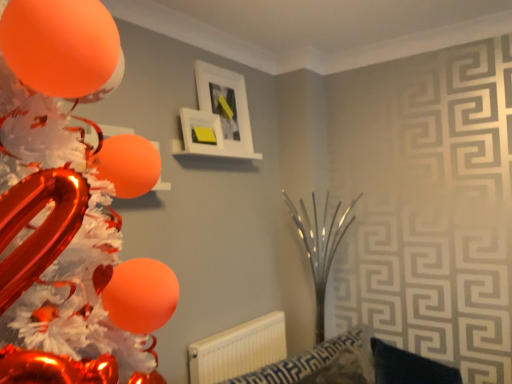
Describe the element at coordinates (217, 116) in the screenshot. The height and width of the screenshot is (384, 512). I see `white matte picture frame at upper center, positioned as the 2th picture frame in front-to-back order` at that location.

You are a GUI agent. You are given a task and a screenshot of the screen. Output one action in this format:
    pyautogui.click(x=<x>, y=<y>)
    Task: Click on the white plastic radiator at lower center
    The width and height of the screenshot is (512, 384).
    Given the screenshot: What is the action you would take?
    pyautogui.click(x=238, y=349)

What do you see at coordinates (201, 132) in the screenshot?
I see `white matte picture frame at upper center, the first picture frame viewed from the front` at bounding box center [201, 132].

At what (x,y) coordinates should I click in order to perform the action: click on white matte picture frame at upper center, positioned as the 2th picture frame in front-to-back order. Please return your answer as a coordinate pair (x, y). The height and width of the screenshot is (384, 512). Looking at the image, I should click on (217, 116).

From the image's perspective, which is below, white matte picture frame at upper center, positioned as the 2th picture frame in front-to-back order, or white plastic radiator at lower center?

From the image's view, white plastic radiator at lower center is below.

This screenshot has width=512, height=384. What are the coordinates of `the 1st picture frame counting from the left side of the white plastic radiator at lower center` in the screenshot? It's located at (217, 116).

From the picture: From a real-world perspective, who is located higher, white matte picture frame at upper center, which is counted as the first picture frame, starting from the back, or white plastic radiator at lower center?

white matte picture frame at upper center, which is counted as the first picture frame, starting from the back, from a real-world perspective.

Considering the relative sizes of white plastic radiator at lower center and white matte picture frame at upper center, positioned as the 2th picture frame in front-to-back order, in the image provided, is white plastic radiator at lower center shorter than white matte picture frame at upper center, positioned as the 2th picture frame in front-to-back order,?

Yes, white plastic radiator at lower center is shorter than white matte picture frame at upper center, positioned as the 2th picture frame in front-to-back order.

Could you measure the distance between white plastic radiator at lower center and white matte picture frame at upper center, which is counted as the first picture frame, starting from the back?

1.06 meters.

This screenshot has width=512, height=384. There is a white plastic radiator at lower center. Find the location of `the 2nd picture frame above it (from the image's perspective)`. the 2nd picture frame above it (from the image's perspective) is located at coordinates (217, 116).

From a real-world perspective, is white plastic radiator at lower center positioned under white matte picture frame at upper center, positioned as the 2th picture frame in front-to-back order, based on gravity?

Yes, from a real-world perspective, white plastic radiator at lower center is below white matte picture frame at upper center, positioned as the 2th picture frame in front-to-back order.

From the image's perspective, is white matte picture frame at upper center, positioned as the 2th picture frame in front-to-back order, over white matte picture frame at upper center, the 2th picture frame in the back-to-front sequence?

Yes, from the image's perspective, white matte picture frame at upper center, positioned as the 2th picture frame in front-to-back order, is above white matte picture frame at upper center, the 2th picture frame in the back-to-front sequence.

Does white matte picture frame at upper center, which is counted as the first picture frame, starting from the back, have a smaller size compared to white matte picture frame at upper center, the first picture frame viewed from the front?

Incorrect, white matte picture frame at upper center, which is counted as the first picture frame, starting from the back, is not smaller in size than white matte picture frame at upper center, the first picture frame viewed from the front.

Who is shorter, white matte picture frame at upper center, which is counted as the first picture frame, starting from the back, or white matte picture frame at upper center, the first picture frame viewed from the front?

white matte picture frame at upper center, the first picture frame viewed from the front.

Based on their sizes in the image, would you say orange glossy balloon at left is bigger or smaller than white matte picture frame at upper center, positioned as the 2th picture frame in front-to-back order?

orange glossy balloon at left is bigger than white matte picture frame at upper center, positioned as the 2th picture frame in front-to-back order.

From the image's perspective, which is below, orange glossy balloon at left or white matte picture frame at upper center, positioned as the 2th picture frame in front-to-back order?

orange glossy balloon at left.

Could you tell me if orange glossy balloon at left is facing white matte picture frame at upper center, which is counted as the first picture frame, starting from the back?

No.

From the image's perspective, count 2nd picture frames upward from the orange glossy balloon at left and point to it. Please provide its 2D coordinates.

[(217, 116)]

Where is `balloon that is above the white plastic radiator at lower center (from the image's perspective)`? balloon that is above the white plastic radiator at lower center (from the image's perspective) is located at coordinates (57, 249).

Would you say white plastic radiator at lower center contains orange glossy balloon at left?

No, orange glossy balloon at left is not surrounded by white plastic radiator at lower center.

From the image's perspective, is white plastic radiator at lower center over orange glossy balloon at left?

Actually, white plastic radiator at lower center appears below orange glossy balloon at left in the image.

Is white plastic radiator at lower center directly adjacent to orange glossy balloon at left?

No, white plastic radiator at lower center is not making contact with orange glossy balloon at left.

Consider the image. From a real-world perspective, is orange glossy balloon at left positioned under white plastic radiator at lower center based on gravity?

Actually, orange glossy balloon at left is physically above white plastic radiator at lower center in the real world.

Looking at their sizes, would you say orange glossy balloon at left is wider or thinner than white plastic radiator at lower center?

In the image, orange glossy balloon at left appears to be wider than white plastic radiator at lower center.

Is orange glossy balloon at left positioned beyond the bounds of white plastic radiator at lower center?

Yes, orange glossy balloon at left is not within white plastic radiator at lower center.

From a real-world perspective, which picture frame is the 1st one above the orange glossy balloon at left? Please provide its 2D coordinates.

[(201, 132)]

Can you confirm if orange glossy balloon at left is smaller than white matte picture frame at upper center, the first picture frame viewed from the front?

Actually, orange glossy balloon at left might be larger than white matte picture frame at upper center, the first picture frame viewed from the front.

Considering the relative positions of orange glossy balloon at left and white matte picture frame at upper center, the 2th picture frame in the back-to-front sequence, in the image provided, is orange glossy balloon at left in front of white matte picture frame at upper center, the 2th picture frame in the back-to-front sequence,?

Yes, it is.

In terms of height, does orange glossy balloon at left look taller or shorter compared to white matte picture frame at upper center, the 2th picture frame in the back-to-front sequence?

orange glossy balloon at left is taller than white matte picture frame at upper center, the 2th picture frame in the back-to-front sequence.

In order to click on picture frame that is the 2nd one above the white plastic radiator at lower center (from a real-world perspective) in this screenshot , I will do `click(217, 116)`.

Locate an element on the screen. radiator below the white matte picture frame at upper center, positioned as the 2th picture frame in front-to-back order (from a real-world perspective) is located at coordinates (238, 349).

Based on their spatial positions, is white plastic radiator at lower center or white matte picture frame at upper center, positioned as the 2th picture frame in front-to-back order, further from orange glossy balloon at left?

Based on the image, white plastic radiator at lower center appears to be further to orange glossy balloon at left.

From the image, which object appears to be nearer to white matte picture frame at upper center, the 2th picture frame in the back-to-front sequence, white plastic radiator at lower center or orange glossy balloon at left?

The object closer to white matte picture frame at upper center, the 2th picture frame in the back-to-front sequence, is white plastic radiator at lower center.

Looking at the image, which one is located closer to white matte picture frame at upper center, positioned as the 2th picture frame in front-to-back order, white matte picture frame at upper center, the first picture frame viewed from the front, or white plastic radiator at lower center?

Among the two, white matte picture frame at upper center, the first picture frame viewed from the front, is located nearer to white matte picture frame at upper center, positioned as the 2th picture frame in front-to-back order.

Looking at the image, which one is located further to white matte picture frame at upper center, the 2th picture frame in the back-to-front sequence, orange glossy balloon at left or white matte picture frame at upper center, positioned as the 2th picture frame in front-to-back order?

orange glossy balloon at left.

From the picture: Estimate the real-world distances between objects in this image. Which object is closer to white matte picture frame at upper center, which is counted as the first picture frame, starting from the back, white matte picture frame at upper center, the 2th picture frame in the back-to-front sequence, or orange glossy balloon at left?

white matte picture frame at upper center, the 2th picture frame in the back-to-front sequence, lies closer to white matte picture frame at upper center, which is counted as the first picture frame, starting from the back, than the other object.

Which object lies further to the anchor point white plastic radiator at lower center, white matte picture frame at upper center, positioned as the 2th picture frame in front-to-back order, or orange glossy balloon at left?

orange glossy balloon at left is positioned further to the anchor white plastic radiator at lower center.

When comparing their distances from white matte picture frame at upper center, positioned as the 2th picture frame in front-to-back order, does orange glossy balloon at left or white plastic radiator at lower center seem closer?

→ white plastic radiator at lower center lies closer to white matte picture frame at upper center, positioned as the 2th picture frame in front-to-back order, than the other object.

From the image, which object appears to be nearer to white matte picture frame at upper center, positioned as the 2th picture frame in front-to-back order, white plastic radiator at lower center or white matte picture frame at upper center, the 2th picture frame in the back-to-front sequence?

Among the two, white matte picture frame at upper center, the 2th picture frame in the back-to-front sequence, is located nearer to white matte picture frame at upper center, positioned as the 2th picture frame in front-to-back order.

What are the coordinates of `radiator between orange glossy balloon at left and white matte picture frame at upper center, the 2th picture frame in the back-to-front sequence, from front to back` in the screenshot? It's located at (238, 349).

Where is `picture frame between white matte picture frame at upper center, which is counted as the first picture frame, starting from the back, and white plastic radiator at lower center, in the vertical direction`? This screenshot has height=384, width=512. picture frame between white matte picture frame at upper center, which is counted as the first picture frame, starting from the back, and white plastic radiator at lower center, in the vertical direction is located at coordinates 201,132.

Where is `picture frame located between orange glossy balloon at left and white matte picture frame at upper center, which is counted as the first picture frame, starting from the back, in the depth direction`? Image resolution: width=512 pixels, height=384 pixels. picture frame located between orange glossy balloon at left and white matte picture frame at upper center, which is counted as the first picture frame, starting from the back, in the depth direction is located at coordinates (201, 132).

This screenshot has height=384, width=512. What are the coordinates of `radiator between orange glossy balloon at left and white matte picture frame at upper center, positioned as the 2th picture frame in front-to-back order, from front to back` in the screenshot? It's located at (238, 349).